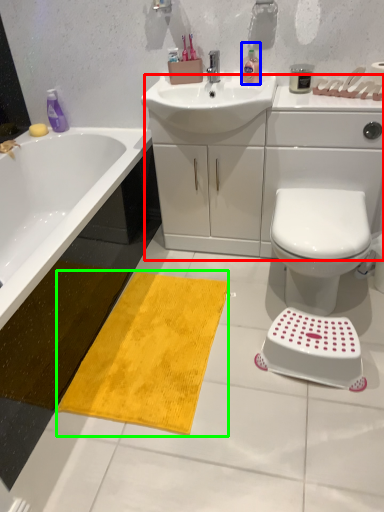
Question: Which object is positioned closest to counter top (highlighted by a red box)? Select from cleaning product (highlighted by a blue box) and beach towel (highlighted by a green box).

Choices:
 (A) cleaning product
 (B) beach towel

Answer: (A)